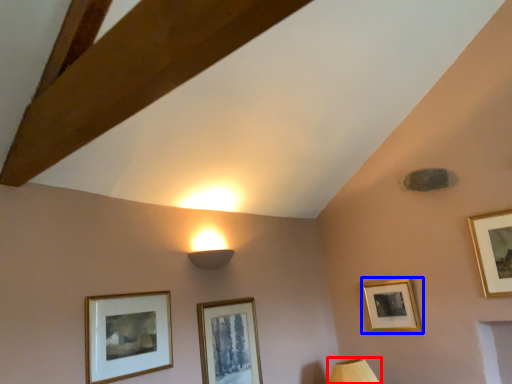
Question: Among these objects, which one is nearest to the camera, table lamp (highlighted by a red box) or picture frame (highlighted by a blue box)?

Choices:
 (A) table lamp
 (B) picture frame

Answer: (A)